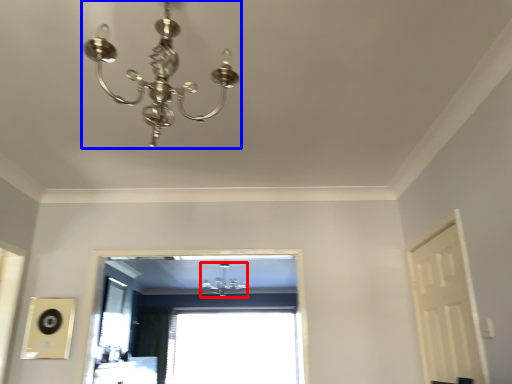
Question: Which point is closer to the camera, lamp (highlighted by a red box) or lamp (highlighted by a blue box)?

Choices:
 (A) lamp
 (B) lamp

Answer: (B)